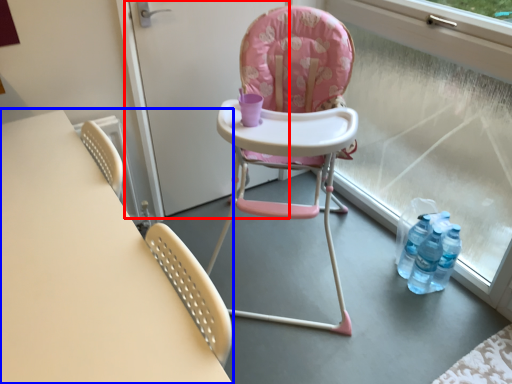
Question: Which object is further to the camera taking this photo, screen door (highlighted by a red box) or table (highlighted by a blue box)?

Choices:
 (A) screen door
 (B) table

Answer: (A)